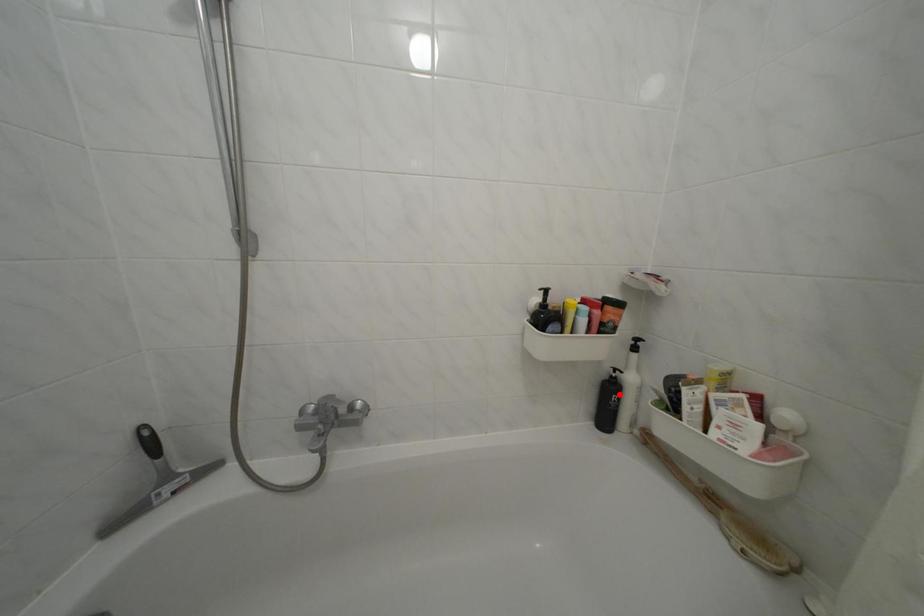
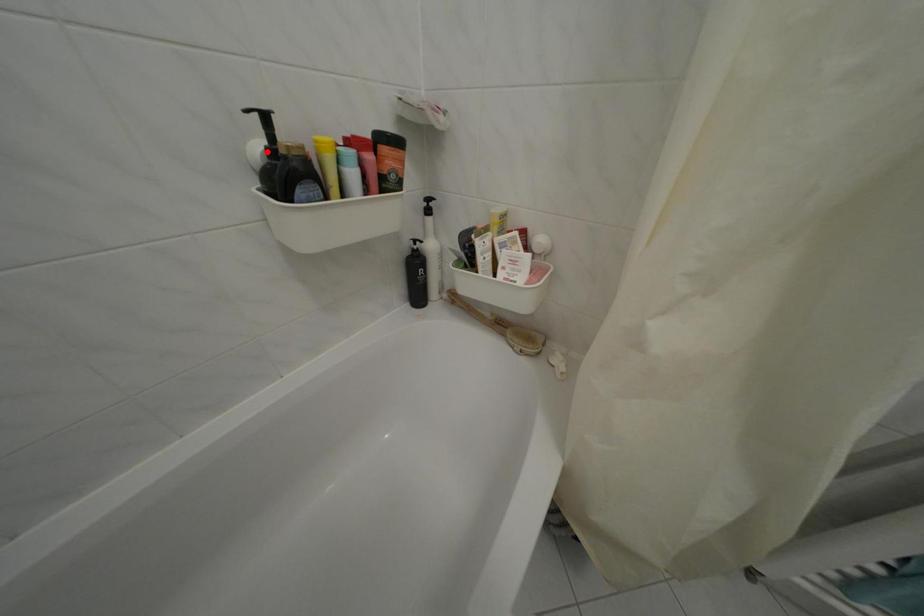
I am providing you with two images of the same scene from different viewpoints. A red point is marked on the first image and another point is marked on the second image. Is the marked point in image1 the same physical position as the marked point in image2?

No